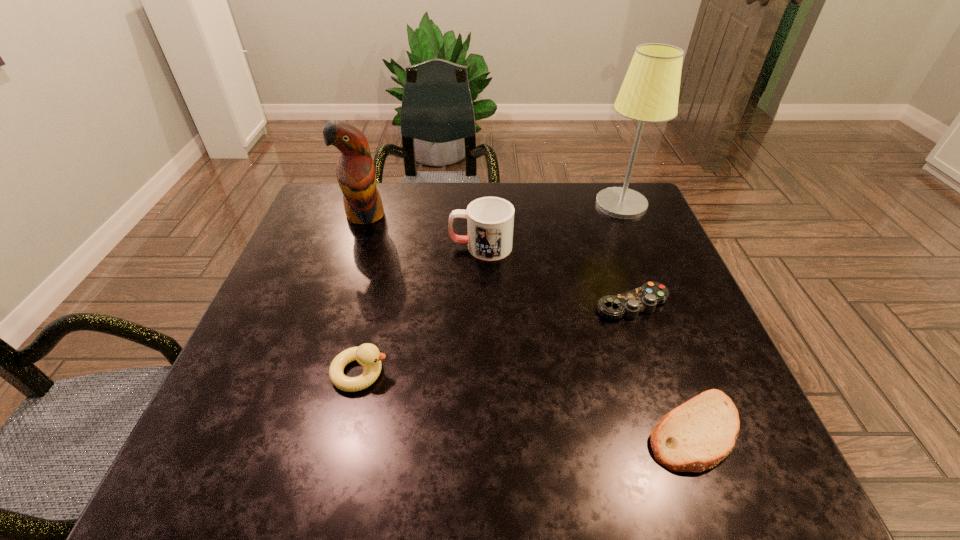
What are the coordinates of `control present at the right edge` in the screenshot? It's located at (645, 298).

Where is `pita bread at the right edge`? The height and width of the screenshot is (540, 960). pita bread at the right edge is located at coordinates click(696, 436).

Identify the location of object that is at the far left corner. This screenshot has height=540, width=960. (356, 174).

Where is `object that is at the far right corner`? The height and width of the screenshot is (540, 960). object that is at the far right corner is located at coordinates (650, 91).

At what (x,y) coordinates should I click in order to perform the action: click on object present at the near right corner. Please return your answer as a coordinate pair (x, y). Looking at the image, I should click on (696, 436).

Where is `free space at the far edge of the desktop`? The height and width of the screenshot is (540, 960). free space at the far edge of the desktop is located at coordinates (583, 219).

Where is `vacant space at the near edge of the desktop`? The height and width of the screenshot is (540, 960). vacant space at the near edge of the desktop is located at coordinates (448, 458).

The width and height of the screenshot is (960, 540). In order to click on free space at the left edge in this screenshot , I will do `click(272, 306)`.

Identify the location of free point at the right edge. This screenshot has height=540, width=960. (678, 269).

The height and width of the screenshot is (540, 960). What are the coordinates of `free space at the far left corner of the desktop` in the screenshot? It's located at (318, 227).